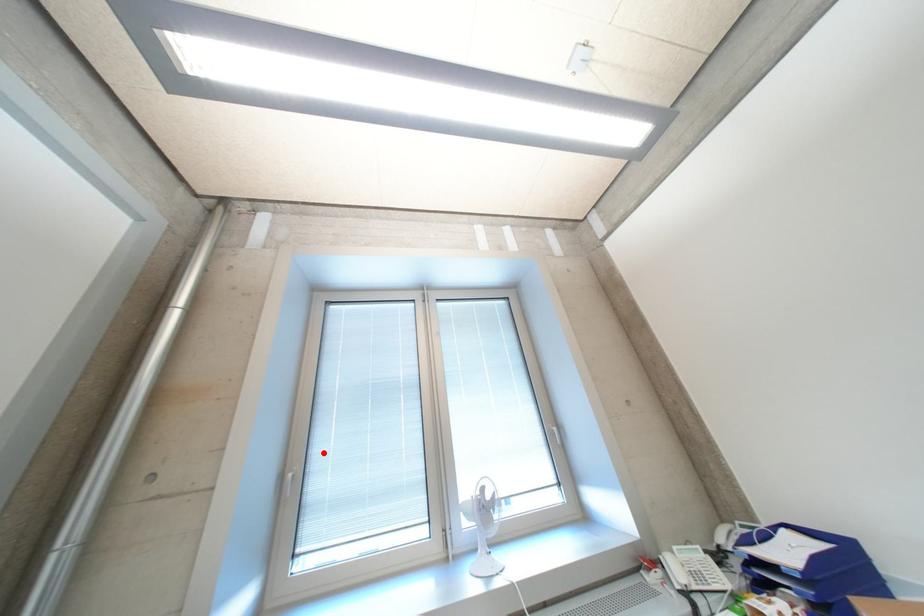
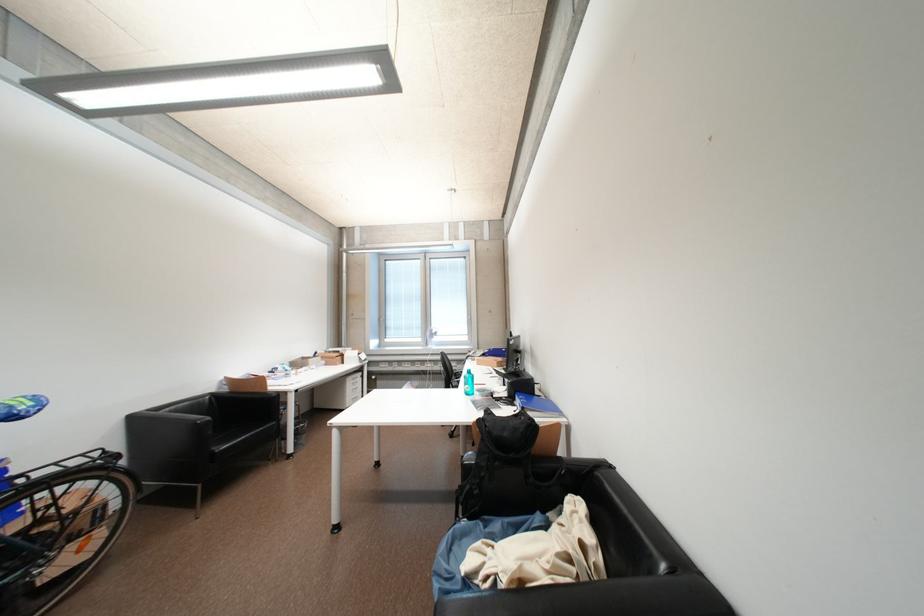
Question: A red point is marked in image1. In image2, is the corresponding 3D point closer to the camera or farther? Reply with the corresponding letter.

Choices:
 (A) The corresponding 3D point is closer.
 (B) The corresponding 3D point is farther.

Answer: (A)